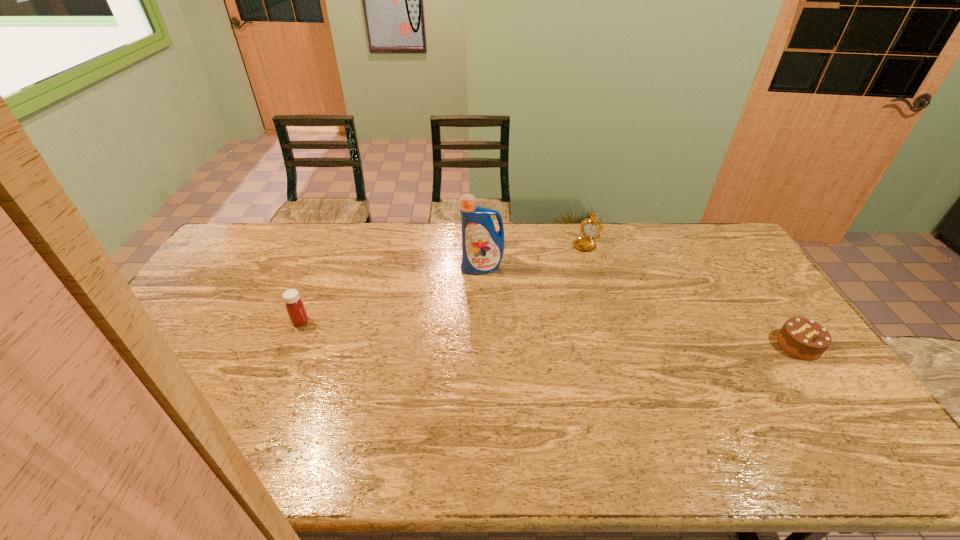
In order to click on free location located 0.400m on the face of the second object from right to left in this screenshot , I will do (x=536, y=323).

You are a GUI agent. You are given a task and a screenshot of the screen. Output one action in this format:
    pyautogui.click(x=<x>, y=<y>)
    Task: Click on the free space located 0.300m on the face of the second object from right to left
    
    Given the screenshot: What is the action you would take?
    pyautogui.click(x=550, y=303)

Image resolution: width=960 pixels, height=540 pixels. Find the location of `blank space located 0.160m on the face of the second object from right to left`. blank space located 0.160m on the face of the second object from right to left is located at coordinates (567, 280).

What are the coordinates of `vacant space located 0.220m on the label of the detergent` in the screenshot? It's located at (475, 321).

Find the location of a particular element. vacant space located on the label of the detergent is located at coordinates (478, 295).

Where is `free region located 0.340m on the label of the detergent`? free region located 0.340m on the label of the detergent is located at coordinates (471, 352).

Where is `object at the far edge`? Image resolution: width=960 pixels, height=540 pixels. object at the far edge is located at coordinates (590, 228).

Locate an element on the screen. The width and height of the screenshot is (960, 540). object that is at the right edge is located at coordinates (803, 338).

Image resolution: width=960 pixels, height=540 pixels. In the image, there is a desktop. Find the location of `vacant region at the far edge`. vacant region at the far edge is located at coordinates (537, 242).

The height and width of the screenshot is (540, 960). In the image, there is a desktop. Find the location of `vacant area at the near edge`. vacant area at the near edge is located at coordinates (320, 407).